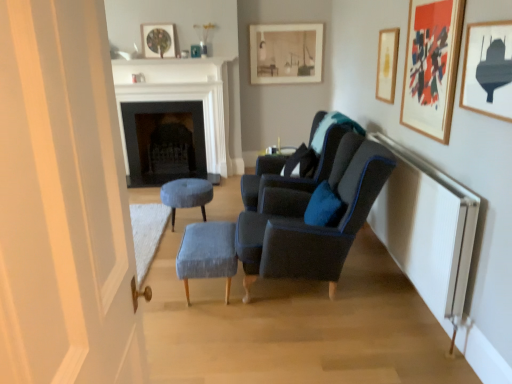
Question: From a real-world perspective, is white marble fireplace at center, which appears as the 1th fireplace when viewed from the front, above or below matte gold picture frame at upper right, acting as the second picture frame starting from the right?

Choices:
 (A) above
 (B) below

Answer: (B)

Question: Visually, is white marble fireplace at center, the 2th fireplace in the back-to-front sequence, positioned to the left or to the right of matte gold picture frame at upper right, the fourth picture frame when ordered from back to front?

Choices:
 (A) right
 (B) left

Answer: (B)

Question: Which is farther from the velvet grey stool at center, arranged as the first stool when viewed from the back?

Choices:
 (A) light blue fabric stool at center, which is counted as the 2th stool, starting from the back
 (B) matte gold picture frame at upper right, which is the 2th picture frame in front-to-back order
 (C) dark gray stone fireplace at center, the 2th fireplace from the front
 (D) velvet dark blue armchair at center, the 2th chair in the back-to-front sequence
 (E) white marble fireplace at center, which appears as the 1th fireplace when viewed from the front

Answer: (B)

Question: Which object is the closest to the white marble fireplace at center, the 2th fireplace in the back-to-front sequence?

Choices:
 (A) dark gray stone fireplace at center, the 2th fireplace from the front
 (B) matte black submarine at upper right, which is the 5th picture frame from left to right
 (C) matte gold picture frame at upper right, placed as the fourth picture frame when sorted from left to right
 (D) light blue fabric stool at center, which is counted as the 2th stool, starting from the back
 (E) gold metallic picture frame at upper right, the 3th picture frame positioned from the back

Answer: (A)